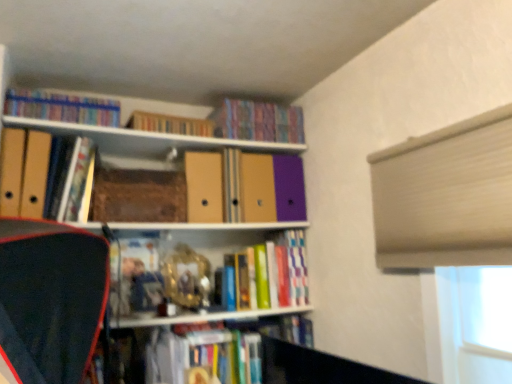
Where is `blank space situated above hardcover books at center, the sixth book viewed from the top (from a real-world perspective)`? blank space situated above hardcover books at center, the sixth book viewed from the top (from a real-world perspective) is located at coordinates (254, 228).